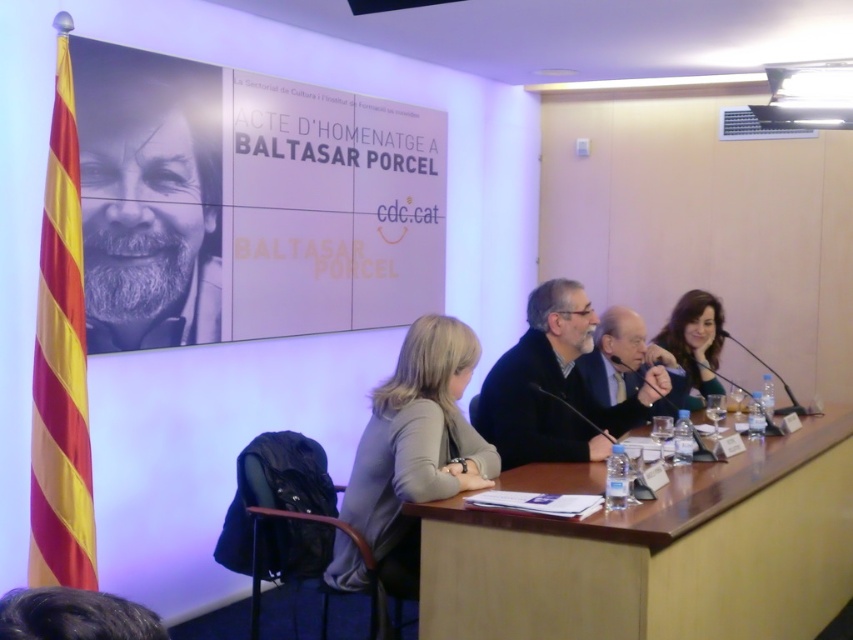
Between point (543, 572) and point (215, 250), which one is positioned behind?

The point (215, 250) is more distant.

Can you confirm if brown wood table at center is positioned below gray beard at upper left?

Yes, brown wood table at center is below gray beard at upper left.

Is point (428, 541) behind point (102, 266)?

No.

The image size is (853, 640). I want to click on brown wood table at center, so click(x=659, y=554).

Is point (155, 636) closer to viewer compared to point (695, 321)?

Yes, it is.

Can you confirm if dark brown hair at lower left is smaller than smooth skin face at upper right?

Indeed, dark brown hair at lower left has a smaller size compared to smooth skin face at upper right.

Image resolution: width=853 pixels, height=640 pixels. What do you see at coordinates (74, 616) in the screenshot?
I see `dark brown hair at lower left` at bounding box center [74, 616].

Where is `dark brown hair at lower left`? dark brown hair at lower left is located at coordinates (74, 616).

Is gray beard at upper left thinner than gray hair man at center?

Indeed, gray beard at upper left has a lesser width compared to gray hair man at center.

Does gray beard at upper left appear on the left side of gray hair man at center?

Indeed, gray beard at upper left is positioned on the left side of gray hair man at center.

Does point (83, 188) come behind point (605, 344)?

No, it is in front of (605, 344).

This screenshot has width=853, height=640. Find the location of `gray beard at upper left`. gray beard at upper left is located at coordinates (148, 196).